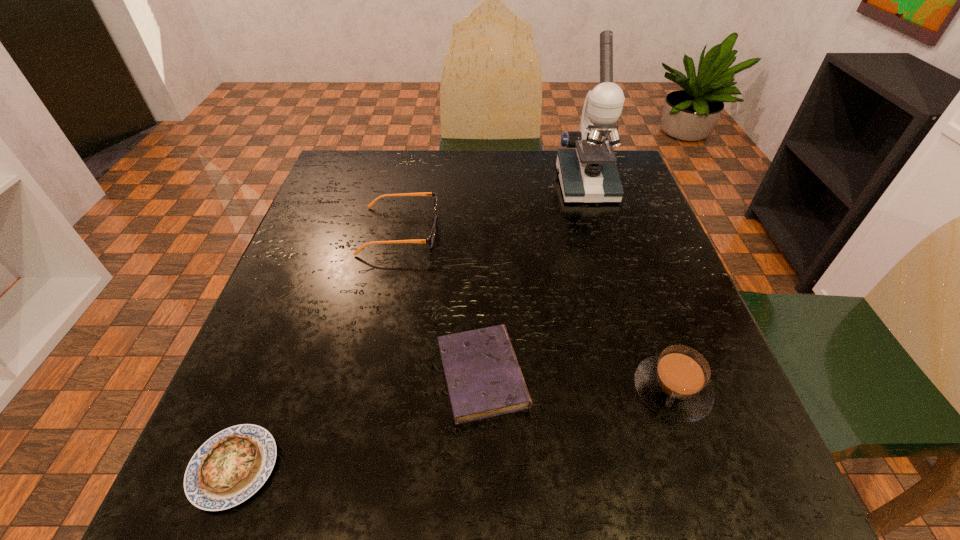
Identify the location of free point located on the front-facing side of the fourth object from right to left. This screenshot has width=960, height=540. (487, 231).

I want to click on vacant space located 0.120m on the right of the third object from left to right, so click(x=601, y=375).

You are a GUI agent. You are given a task and a screenshot of the screen. Output one action in this format:
    pyautogui.click(x=<x>, y=<y>)
    Task: Click on the free region located 0.050m on the right of the leftmost object
    The height and width of the screenshot is (540, 960).
    Given the screenshot: What is the action you would take?
    pyautogui.click(x=311, y=468)

The image size is (960, 540). I want to click on object located in the far edge section of the desktop, so click(x=587, y=170).

Find the location of a particular element. object that is at the near edge is located at coordinates (231, 466).

What are the coordinates of `spectacles positioned at the left edge` in the screenshot? It's located at (430, 240).

Locate an element on the screen. Image resolution: width=960 pixels, height=540 pixels. quiche that is at the left edge is located at coordinates (231, 466).

Locate an element on the screen. The height and width of the screenshot is (540, 960). microscope at the right edge is located at coordinates (587, 170).

You are a GUI agent. You are given a task and a screenshot of the screen. Output one action in this format:
    pyautogui.click(x=<x>, y=<y>)
    Task: Click on the cappuccino positioned at the right edge
    The width and height of the screenshot is (960, 540).
    Given the screenshot: What is the action you would take?
    pyautogui.click(x=675, y=384)

You are a GUI agent. You are given a task and a screenshot of the screen. Output one action in this format:
    pyautogui.click(x=<x>, y=<y>)
    Task: Click on the object at the near left corner
    Image resolution: width=960 pixels, height=540 pixels.
    Given the screenshot: What is the action you would take?
    pyautogui.click(x=231, y=466)